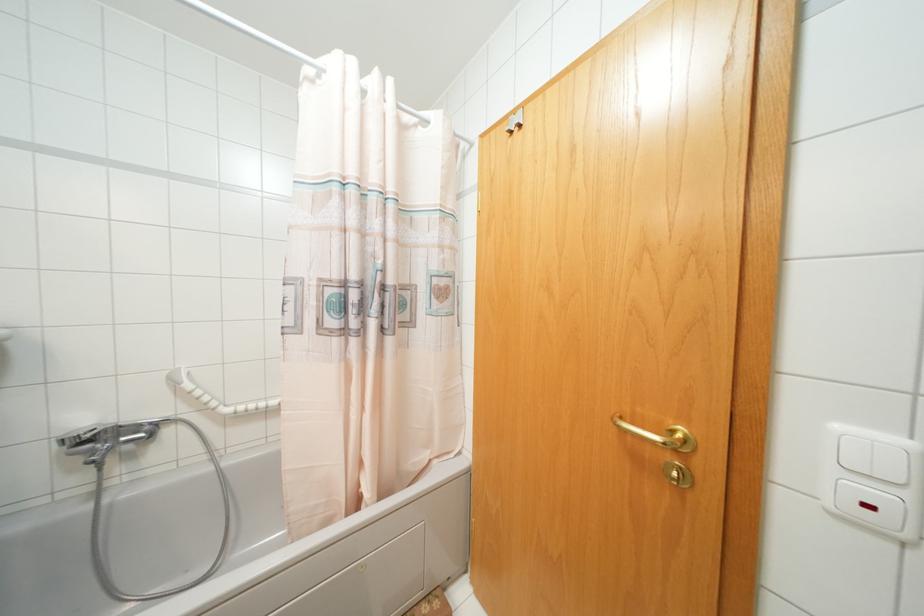
What do you see at coordinates (102, 432) in the screenshot? I see `the faucet lever` at bounding box center [102, 432].